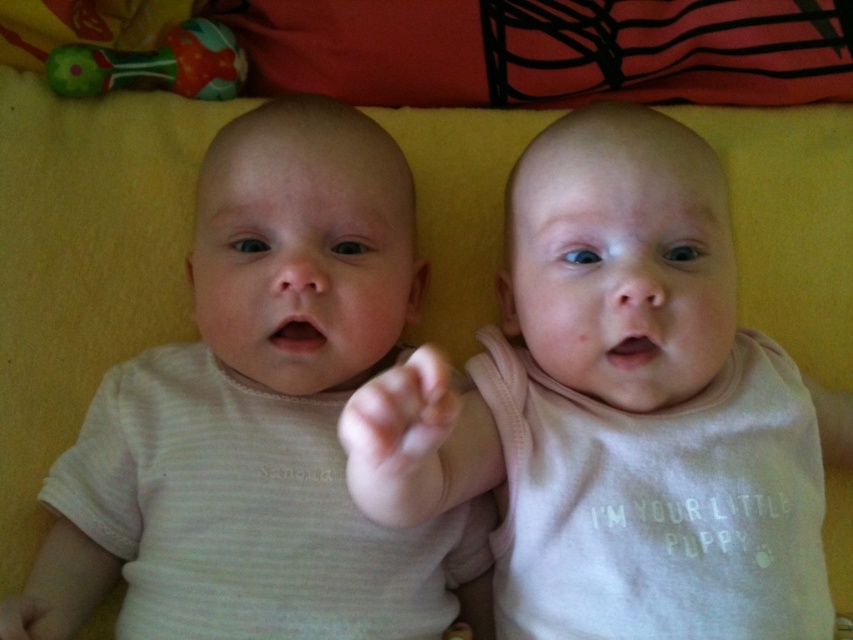
Is pink soft fabric baby at center behind matte plastic rattle at upper left?

No, it is not.

Based on the photo, is pink soft fabric baby at center above matte plastic rattle at upper left?

No, pink soft fabric baby at center is not above matte plastic rattle at upper left.

This screenshot has width=853, height=640. Describe the element at coordinates (572, 364) in the screenshot. I see `pink soft fabric baby at center` at that location.

Where is `pink soft fabric baby at center`? The height and width of the screenshot is (640, 853). pink soft fabric baby at center is located at coordinates (572, 364).

Is white ribbed fabric baby at center taller than matte plastic rattle at upper left?

Yes, white ribbed fabric baby at center is taller than matte plastic rattle at upper left.

Is point (399, 177) positioned after point (138, 56)?

No, it is in front of (138, 56).

This screenshot has height=640, width=853. In order to click on white ribbed fabric baby at center in this screenshot , I will do `click(260, 403)`.

Who is positioned more to the left, white ribbed fabric baby at center or pink soft fabric baby at center?

white ribbed fabric baby at center is more to the left.

At what (x,y) coordinates should I click in order to perform the action: click on white ribbed fabric baby at center. Please return your answer as a coordinate pair (x, y). This screenshot has height=640, width=853. Looking at the image, I should click on (260, 403).